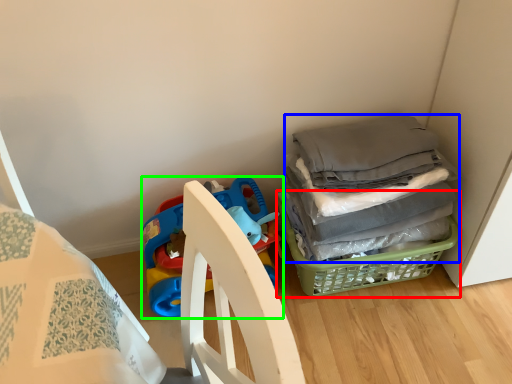
Question: Based on their relative distances, which object is nearer to basket (highlighted by a red box)? Choose from clothing (highlighted by a blue box) and toy (highlighted by a green box).

Choices:
 (A) clothing
 (B) toy

Answer: (A)